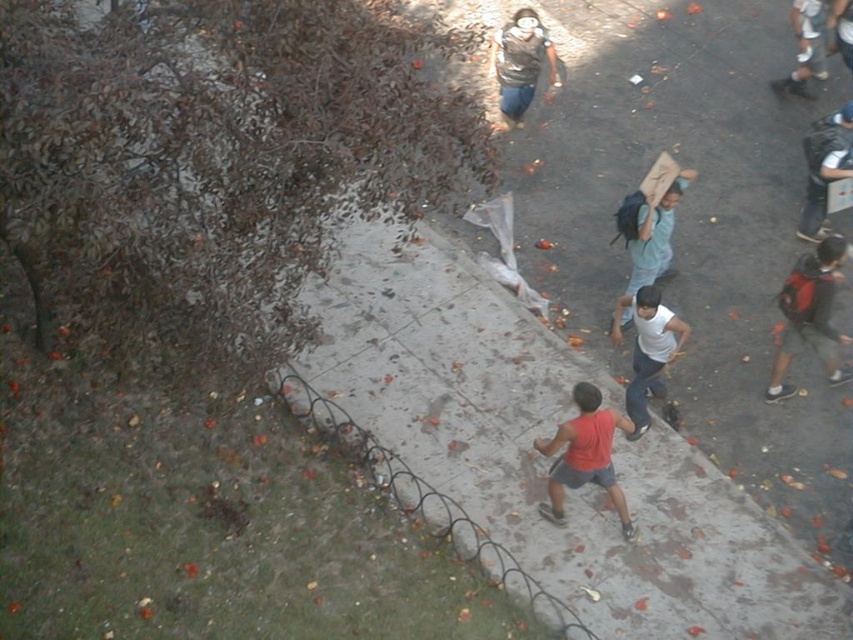
Question: Estimate the real-world distances between objects in this image. Which object is closer to the dark blue backpack at upper right?

Choices:
 (A) red backpack at right
 (B) white matte shirt at center
 (C) dark blue backpack at right
 (D) light blue fabric at center

Answer: (C)

Question: Which of the following is the closest to the observer?

Choices:
 (A) (846, 67)
 (B) (633, 349)

Answer: (B)

Question: Can you confirm if white matte shirt at center is positioned above light blue jeans at upper right?

Choices:
 (A) yes
 (B) no

Answer: (B)

Question: Does red matte tank top at center have a smaller size compared to dark blue backpack at right?

Choices:
 (A) yes
 (B) no

Answer: (B)

Question: Which point is farther to the camera?

Choices:
 (A) red matte tank top at center
 (B) red backpack at right
 (C) dark blue backpack at upper right
 (D) light blue fabric at center

Answer: (C)

Question: Does red matte tank top at center appear on the right side of white matte shirt at center?

Choices:
 (A) no
 (B) yes

Answer: (A)